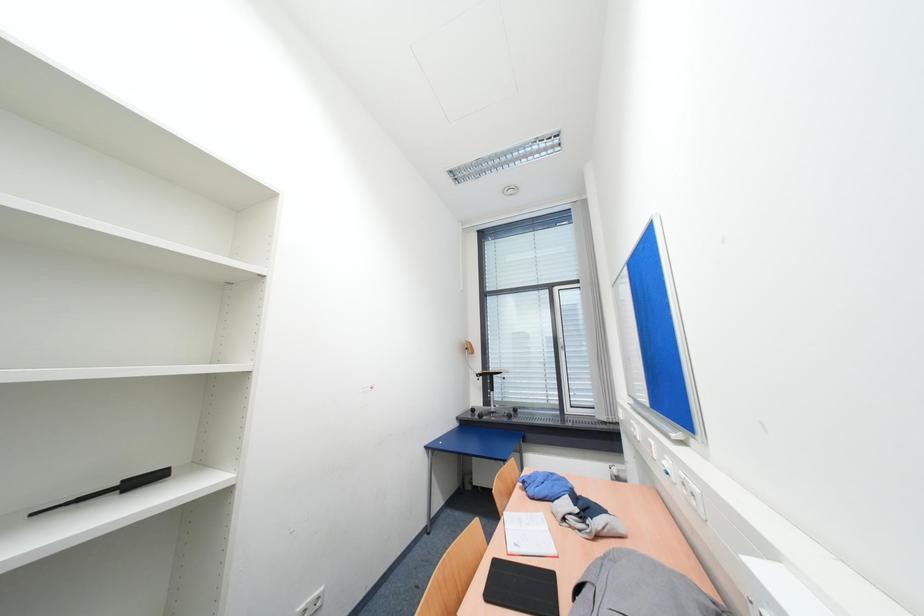
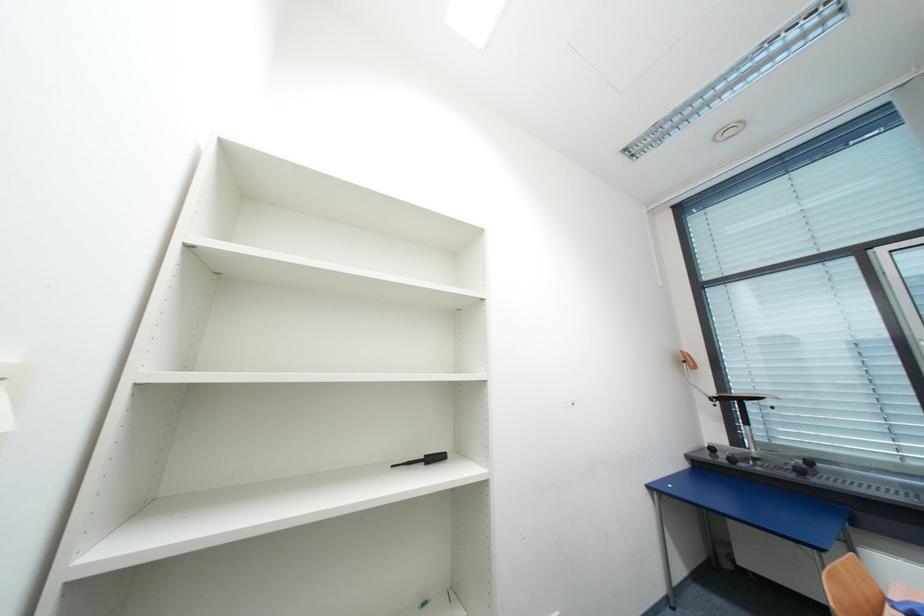
Question: How did the camera likely rotate?

Choices:
 (A) Left
 (B) Right
 (C) Up
 (D) Down

Answer: (A)